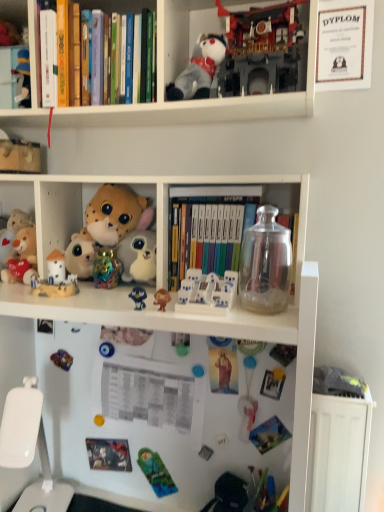
Question: Considering their positions, is brown matte monkey at center, which ranks as the second toy in bottom-to-top order, located in front of or behind fluffy white plush at center-left, acting as the sixth toy starting from the bottom?

Choices:
 (A) behind
 (B) front

Answer: (B)

Question: Which is correct: brown matte monkey at center, which is the ninth toy from top to bottom, is inside fluffy white plush at center-left, acting as the sixth toy starting from the bottom, or outside of it?

Choices:
 (A) outside
 (B) inside

Answer: (A)

Question: Considering the real-world distances, which object is farthest from the fluffy white plush at center-left, the 5th toy in the top-to-bottom sequence?

Choices:
 (A) soft plush toy at center, which is the 7th toy from bottom to top
 (B) white plastic toy at center, which appears as the 7th toy when viewed from the top
 (C) hardcover books at upper left, which ranks as the first book in left-to-right order
 (D) fluffy gray stuffed toy at upper center, marked as the 2th toy in a top-to-bottom arrangement
 (E) white plastic toy at left, the 5th toy in the bottom-to-top sequence

Answer: (D)

Question: Based on their relative distances, which object is nearer to the hardcover books at upper left, which appears as the 2th book when viewed from the right?

Choices:
 (A) green plastic toy at lower center, placed as the tenth toy when sorted from top to bottom
 (B) fluffy gray stuffed toy at upper center, the 9th toy from the bottom
 (C) white plastic toy at left, the 5th toy in the bottom-to-top sequence
 (D) white matte bookshelf at upper center
 (E) transparent glass jar at center, placed as the first book when sorted from right to left

Answer: (B)